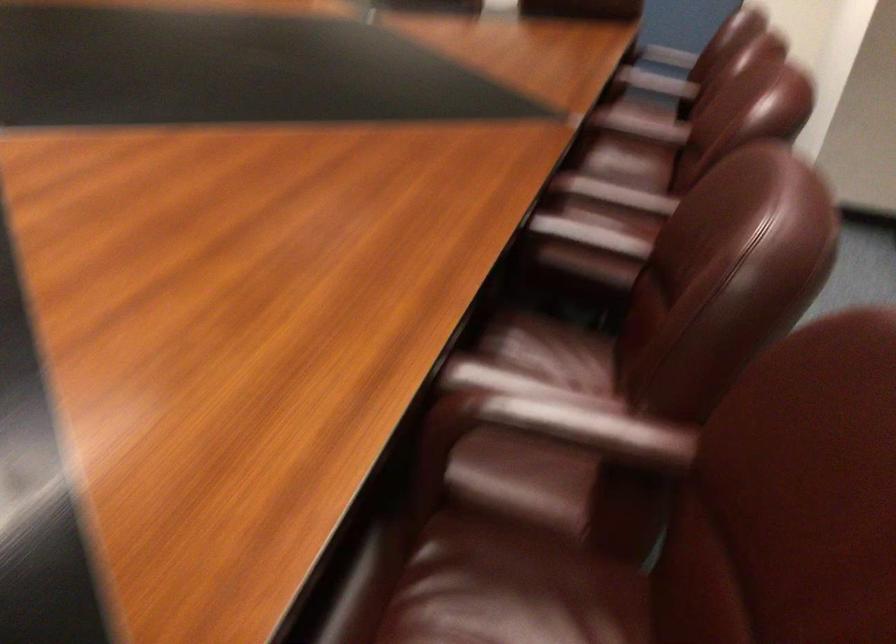
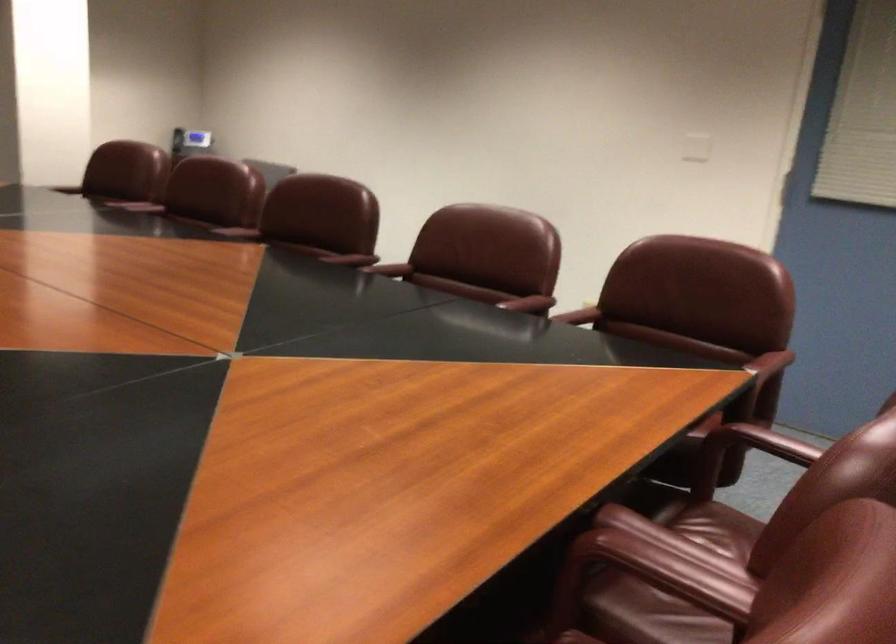
In the second image, find the point that corresponds to the point at 659,82 in the first image.

(657, 573)